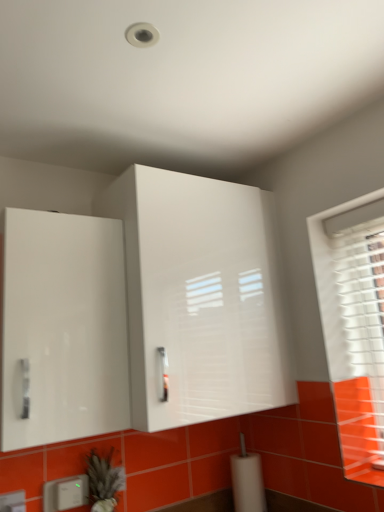
Question: Is white glossy cabinet at upper center, the 2th cabinetry in the left-to-right sequence, directly adjacent to white plastic electric outlet at lower left, which ranks as the 1th electric outlet in back-to-front order?

Choices:
 (A) no
 (B) yes

Answer: (A)

Question: Considering the relative positions of white glossy cabinet at upper center, the 2th cabinetry in the left-to-right sequence, and white plastic electric outlet at lower left, acting as the second electric outlet starting from the front, in the image provided, is white glossy cabinet at upper center, the 2th cabinetry in the left-to-right sequence, to the left of white plastic electric outlet at lower left, acting as the second electric outlet starting from the front, from the viewer's perspective?

Choices:
 (A) no
 (B) yes

Answer: (A)

Question: Is the depth of white glossy cabinet at upper center, placed as the first cabinetry when sorted from right to left, greater than that of white plastic electric outlet at lower left, positioned as the first electric outlet in right-to-left order?

Choices:
 (A) yes
 (B) no

Answer: (B)

Question: Is white glossy cabinet at upper center, placed as the first cabinetry when sorted from right to left, closer to the viewer compared to white plastic electric outlet at lower left, which ranks as the 1th electric outlet in back-to-front order?

Choices:
 (A) yes
 (B) no

Answer: (A)

Question: Does white glossy cabinet at upper center, placed as the first cabinetry when sorted from right to left, have a larger size compared to white plastic electric outlet at lower left, acting as the second electric outlet starting from the front?

Choices:
 (A) no
 (B) yes

Answer: (B)

Question: From a real-world perspective, is white glossy cabinet at upper center, the 2th cabinetry in the left-to-right sequence, positioned under white plastic electric outlet at lower left, which ranks as the 1th electric outlet in back-to-front order, based on gravity?

Choices:
 (A) no
 (B) yes

Answer: (A)

Question: Can you confirm if white glossy cabinet at left, the first cabinetry in the left-to-right sequence, is positioned to the left of white plastic electric outlet at lower left, which ranks as the 1th electric outlet in back-to-front order?

Choices:
 (A) no
 (B) yes

Answer: (B)

Question: Is white glossy cabinet at left, the second cabinetry positioned from the right, behind white plastic electric outlet at lower left, which ranks as the 1th electric outlet in back-to-front order?

Choices:
 (A) yes
 (B) no

Answer: (B)

Question: Would you say white glossy cabinet at left, the second cabinetry positioned from the right, contains white plastic electric outlet at lower left, which ranks as the 1th electric outlet in back-to-front order?

Choices:
 (A) yes
 (B) no

Answer: (B)

Question: Does white glossy cabinet at left, the second cabinetry positioned from the right, have a greater height compared to white plastic electric outlet at lower left, which ranks as the 1th electric outlet in back-to-front order?

Choices:
 (A) no
 (B) yes

Answer: (B)

Question: From the image's perspective, is white glossy cabinet at left, the first cabinetry in the left-to-right sequence, on white plastic electric outlet at lower left, positioned as the first electric outlet in right-to-left order?

Choices:
 (A) no
 (B) yes

Answer: (B)

Question: Considering the relative sizes of white glossy cabinet at left, the second cabinetry positioned from the right, and white plastic electric outlet at lower left, positioned as the first electric outlet in right-to-left order, in the image provided, is white glossy cabinet at left, the second cabinetry positioned from the right, wider than white plastic electric outlet at lower left, positioned as the first electric outlet in right-to-left order,?

Choices:
 (A) yes
 (B) no

Answer: (A)

Question: Is white plastic electric outlet at lower left, which appears as the first electric outlet when viewed from the left, a part of white plastic electric outlet at lower left, arranged as the second electric outlet when viewed from the left?

Choices:
 (A) yes
 (B) no

Answer: (B)